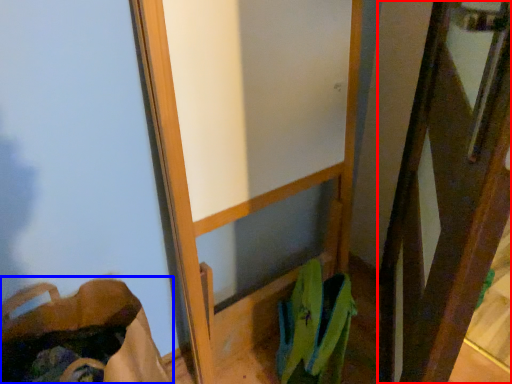
Question: Among these objects, which one is nearest to the camera, screen door (highlighted by a red box) or shoulder bag (highlighted by a blue box)?

Choices:
 (A) screen door
 (B) shoulder bag

Answer: (A)